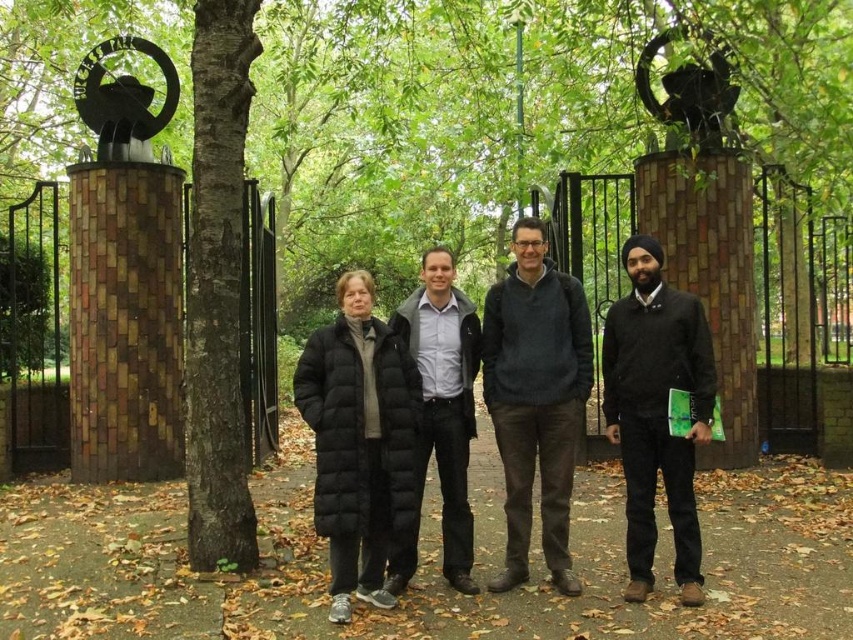
Question: Is black puffer coat at center above black matte jacket at right?

Choices:
 (A) yes
 (B) no

Answer: (B)

Question: Among these objects, which one is farthest from the camera?

Choices:
 (A) dark brown bark at center
 (B) dark gray sweater at center

Answer: (A)

Question: Can you confirm if black quilted coat at center is thinner than black matte jacket at right?

Choices:
 (A) no
 (B) yes

Answer: (A)

Question: Is dark brown bark at center positioned at the back of black puffer jacket at center?

Choices:
 (A) no
 (B) yes

Answer: (B)

Question: Which point is closer to the camera taking this photo?

Choices:
 (A) (688, 387)
 (B) (636, 596)
 (C) (444, 524)
 (D) (196, 93)

Answer: (B)

Question: Which point is closer to the camera taking this photo?

Choices:
 (A) (683, 292)
 (B) (566, 577)
 (C) (312, 406)
 (D) (209, 61)

Answer: (C)